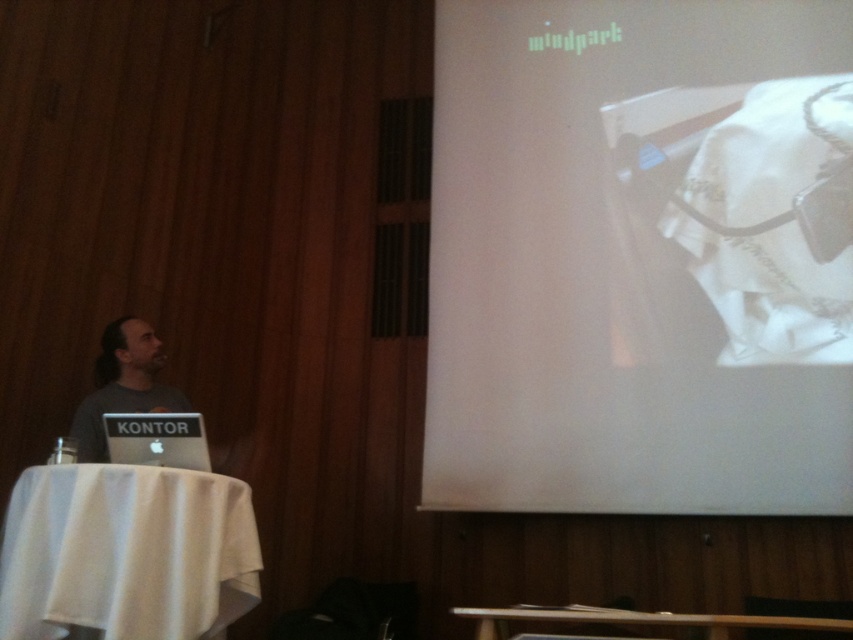
Question: Is white glossy projector screen at upper right further to the viewer compared to silver metallic laptop at lower left?

Choices:
 (A) no
 (B) yes

Answer: (B)

Question: Is white glossy projector screen at upper right to the left of silver metallic laptop at lower left from the viewer's perspective?

Choices:
 (A) no
 (B) yes

Answer: (A)

Question: Is gray matte laptop at left to the right of silver metallic laptop at lower left from the viewer's perspective?

Choices:
 (A) no
 (B) yes

Answer: (A)

Question: Which point is closer to the camera?

Choices:
 (A) (143, 356)
 (B) (734, 289)
 (C) (177, 458)

Answer: (C)

Question: Which of the following is the closest to the observer?

Choices:
 (A) (165, 422)
 (B) (152, 390)
 (C) (593, 54)

Answer: (A)

Question: Among these objects, which one is nearest to the camera?

Choices:
 (A) white glossy projector screen at upper right
 (B) silver metallic laptop at lower left

Answer: (B)